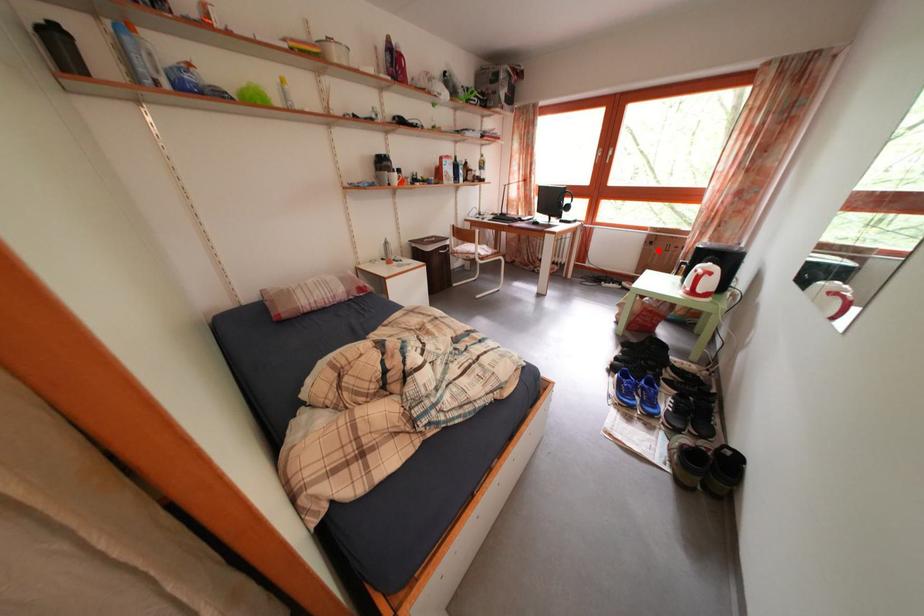
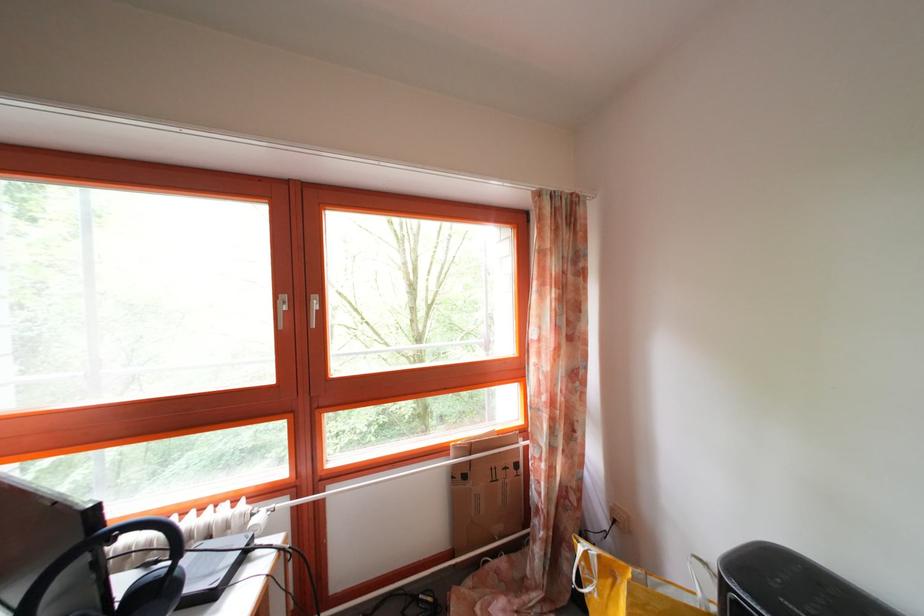
Question: A red point is marked in image1. In image2, is the corresponding 3D point closer to the camera or farther? Reply with the corresponding letter.

Choices:
 (A) The corresponding 3D point is closer.
 (B) The corresponding 3D point is farther.

Answer: (B)